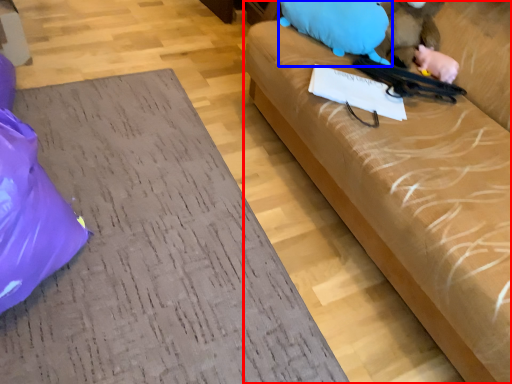
Question: Which of the following is the closest to the observer, studio couch (highlighted by a red box) or animal (highlighted by a blue box)?

Choices:
 (A) studio couch
 (B) animal

Answer: (A)